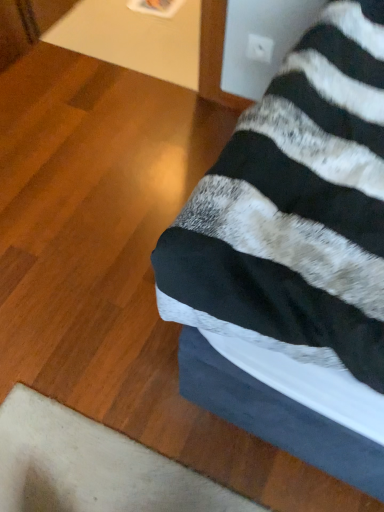
Image resolution: width=384 pixels, height=512 pixels. Identify the location of white plastic electric outlet at upper center. click(x=259, y=48).

This screenshot has height=512, width=384. What do you see at coordinates (259, 48) in the screenshot?
I see `white plastic electric outlet at upper center` at bounding box center [259, 48].

This screenshot has height=512, width=384. Find the location of `white plastic electric outlet at upper center`. white plastic electric outlet at upper center is located at coordinates (259, 48).